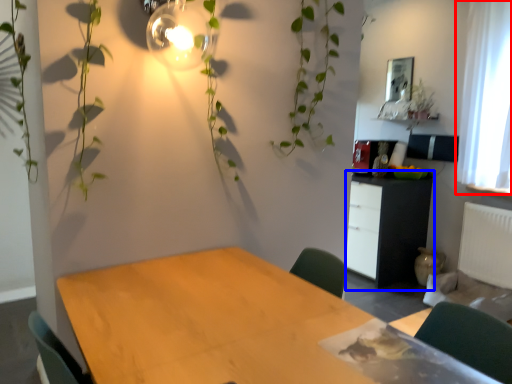
Question: Which object appears closest to the camera in this image, curtain (highlighted by a red box) or cabinetry (highlighted by a blue box)?

Choices:
 (A) curtain
 (B) cabinetry

Answer: (A)